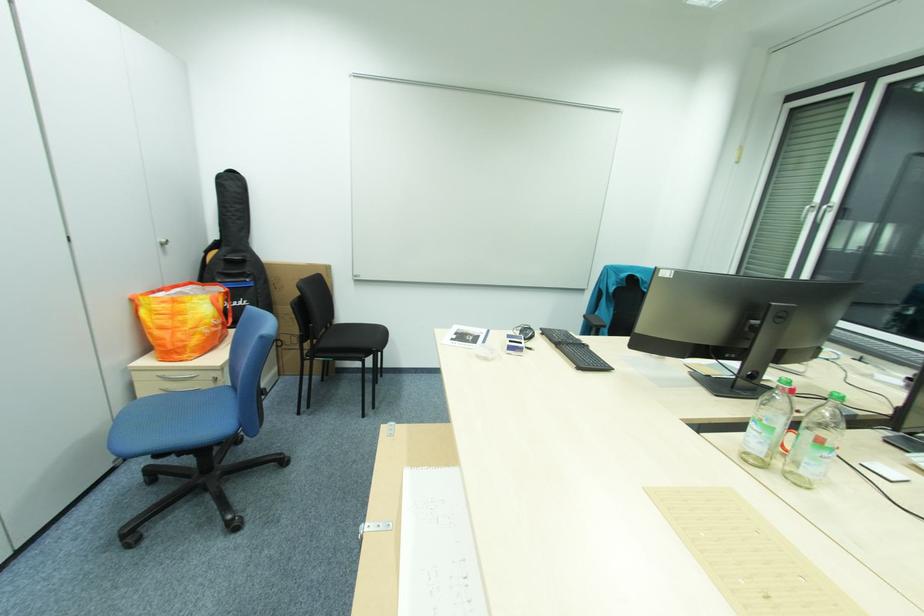
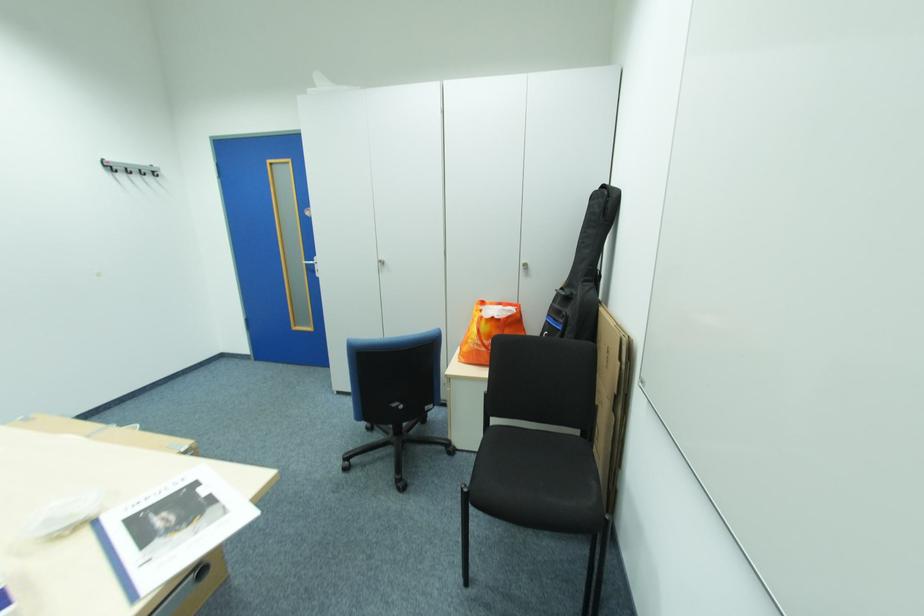
Locate, in the second image, the point that corresponds to point 256,277 in the first image.

(572, 318)